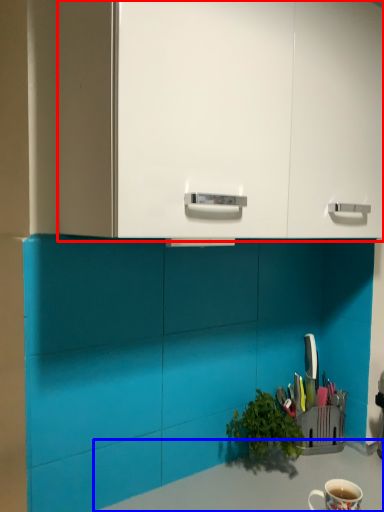
Question: Which object appears closest to the camera in this image, dresser (highlighted by a red box) or counter top (highlighted by a blue box)?

Choices:
 (A) dresser
 (B) counter top

Answer: (A)